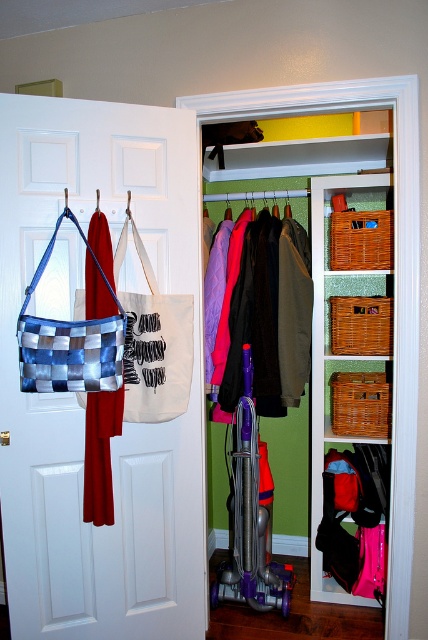
Does white matte door at left have a greater height compared to blue woven bag at left?

Correct, white matte door at left is much taller as blue woven bag at left.

Does point (192, 157) come closer to viewer compared to point (70, 380)?

That is False.

Find the location of a particular element. This screenshot has width=428, height=640. white matte door at left is located at coordinates (74, 394).

Who is positioned more to the left, woven wicker baskets at upper center or dark green fabric pants at center?

dark green fabric pants at center is more to the left.

What do you see at coordinates (329, 358) in the screenshot? The height and width of the screenshot is (640, 428). I see `woven wicker baskets at upper center` at bounding box center [329, 358].

This screenshot has width=428, height=640. Find the location of `woven wicker baskets at upper center`. woven wicker baskets at upper center is located at coordinates (329, 358).

Where is `woven wicker baskets at upper center`? woven wicker baskets at upper center is located at coordinates (329, 358).

Does matte wicker basket at center right lie in front of purple plastic vacuum cleaner at center?

No.

Does point (350, 440) come closer to viewer compared to point (259, 442)?

Yes, it is.

Does point (318, 252) come behind point (234, 488)?

No, it is not.

Image resolution: width=428 pixels, height=640 pixels. I want to click on matte wicker basket at center right, so click(330, 337).